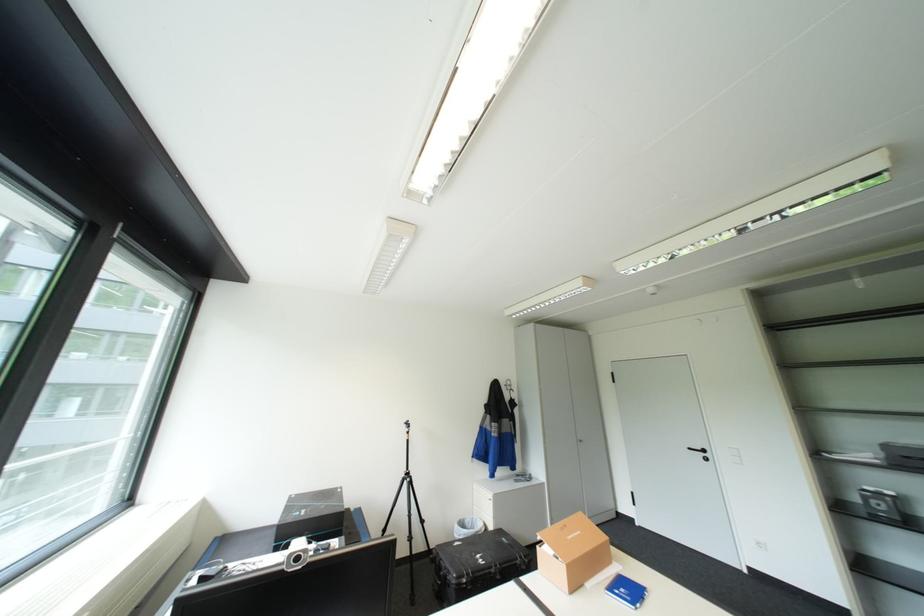
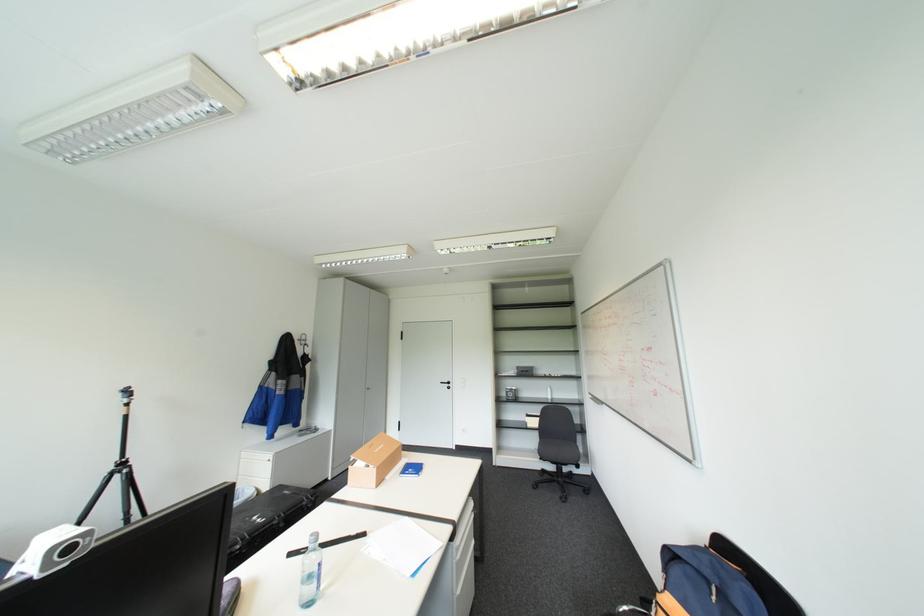
Question: The camera is either moving clockwise (left) or counter-clockwise (right) around the object. The first image is from the beginning of the video and the second image is from the end. Is the camera moving left or right when shooting the video?

Choices:
 (A) Left
 (B) Right

Answer: (A)